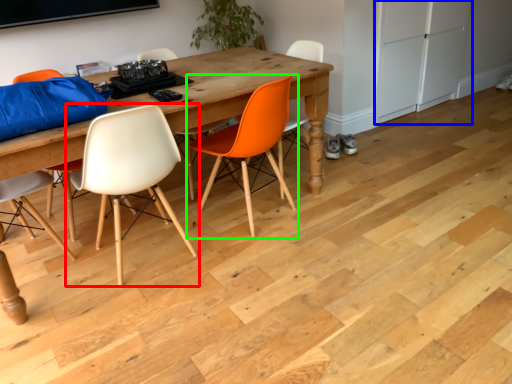
Question: Considering the real-world distances, which object is farthest from chair (highlighted by a red box)? cabinetry (highlighted by a blue box) or chair (highlighted by a green box)?

Choices:
 (A) cabinetry
 (B) chair

Answer: (A)